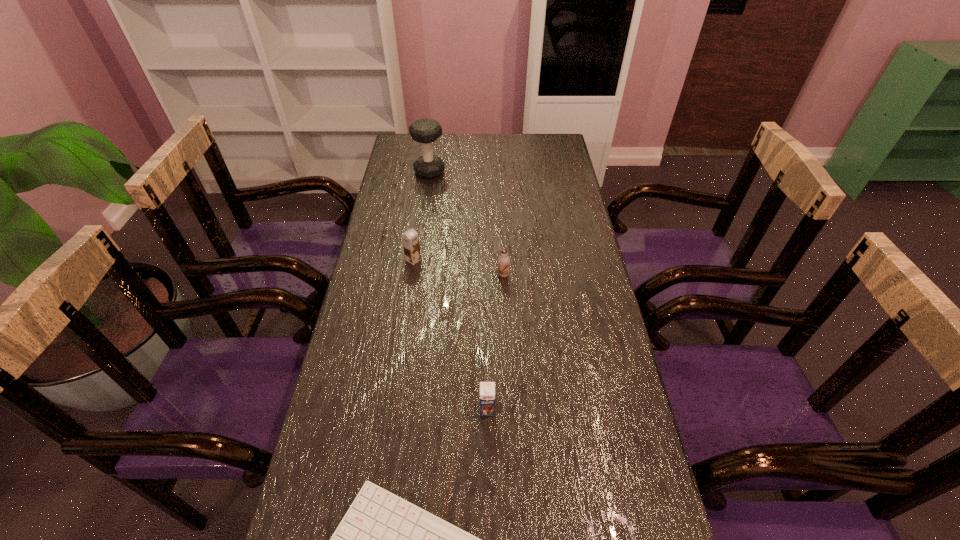
Identify the location of free point located on the back of the third nearest object. (499, 200).

The image size is (960, 540). Identify the location of vacant space located 0.100m on the front label of the second chocolate milk from right to left. (488, 458).

At what (x,y) coordinates should I click in order to perform the action: click on dumbbell positioned at the left edge. Please return your answer as a coordinate pair (x, y). The height and width of the screenshot is (540, 960). Looking at the image, I should click on (425, 131).

Where is `chocolate milk that is at the left edge`? Image resolution: width=960 pixels, height=540 pixels. chocolate milk that is at the left edge is located at coordinates (410, 239).

Locate an element on the screen. The image size is (960, 540). vacant space at the far edge of the desktop is located at coordinates (446, 134).

I want to click on blank area at the left edge, so click(380, 272).

In the image, there is a desktop. At what (x,y) coordinates should I click in order to perform the action: click on blank space at the right edge. Please return your answer as a coordinate pair (x, y). This screenshot has height=540, width=960. Looking at the image, I should click on (546, 259).

The height and width of the screenshot is (540, 960). I want to click on free space at the far right corner of the desktop, so click(x=539, y=163).

Locate an element on the screen. The image size is (960, 540). free area in between the tallest object and the second nearest chocolate milk is located at coordinates (467, 224).

Locate an element on the screen. This screenshot has height=540, width=960. vacant space in between the fourth farthest object and the second nearest chocolate milk is located at coordinates (495, 342).